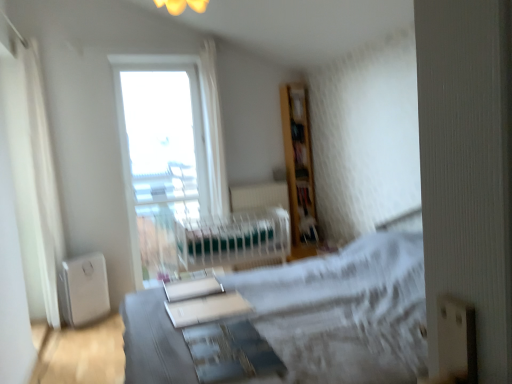
Question: Is wooden bookshelf at upper right oriented away from white sheer curtain at left?

Choices:
 (A) yes
 (B) no

Answer: (B)

Question: Considering the relative sizes of wooden bookshelf at upper right and white sheer curtain at left in the image provided, is wooden bookshelf at upper right taller than white sheer curtain at left?

Choices:
 (A) yes
 (B) no

Answer: (B)

Question: From the image's perspective, is wooden bookshelf at upper right over white sheer curtain at left?

Choices:
 (A) yes
 (B) no

Answer: (A)

Question: Is wooden bookshelf at upper right surrounding white sheer curtain at left?

Choices:
 (A) no
 (B) yes

Answer: (A)

Question: From a real-world perspective, is wooden bookshelf at upper right on top of white sheer curtain at left?

Choices:
 (A) yes
 (B) no

Answer: (A)

Question: Considering the positions of green fabric hospital bed at center and wooden bookshelf at upper right in the image, is green fabric hospital bed at center wider or thinner than wooden bookshelf at upper right?

Choices:
 (A) thin
 (B) wide

Answer: (B)

Question: From a real-world perspective, is green fabric hospital bed at center above or below wooden bookshelf at upper right?

Choices:
 (A) above
 (B) below

Answer: (B)

Question: Is green fabric hospital bed at center taller or shorter than wooden bookshelf at upper right?

Choices:
 (A) short
 (B) tall

Answer: (A)

Question: Considering their positions, is green fabric hospital bed at center located in front of or behind wooden bookshelf at upper right?

Choices:
 (A) front
 (B) behind

Answer: (A)

Question: Is white sheer curtain at left situated inside transparent glass window at upper center or outside?

Choices:
 (A) inside
 (B) outside

Answer: (B)

Question: Looking at their shapes, would you say white sheer curtain at left is wider or thinner than transparent glass window at upper center?

Choices:
 (A) thin
 (B) wide

Answer: (B)

Question: Would you say white sheer curtain at left is to the left or to the right of transparent glass window at upper center in the picture?

Choices:
 (A) left
 (B) right

Answer: (A)

Question: Is white sheer curtain at left bigger or smaller than transparent glass window at upper center?

Choices:
 (A) small
 (B) big

Answer: (A)

Question: In the image, is green fabric hospital bed at center on the left side or the right side of transparent glass window at upper center?

Choices:
 (A) right
 (B) left

Answer: (A)

Question: Is green fabric hospital bed at center in front of or behind transparent glass window at upper center in the image?

Choices:
 (A) behind
 (B) front

Answer: (B)